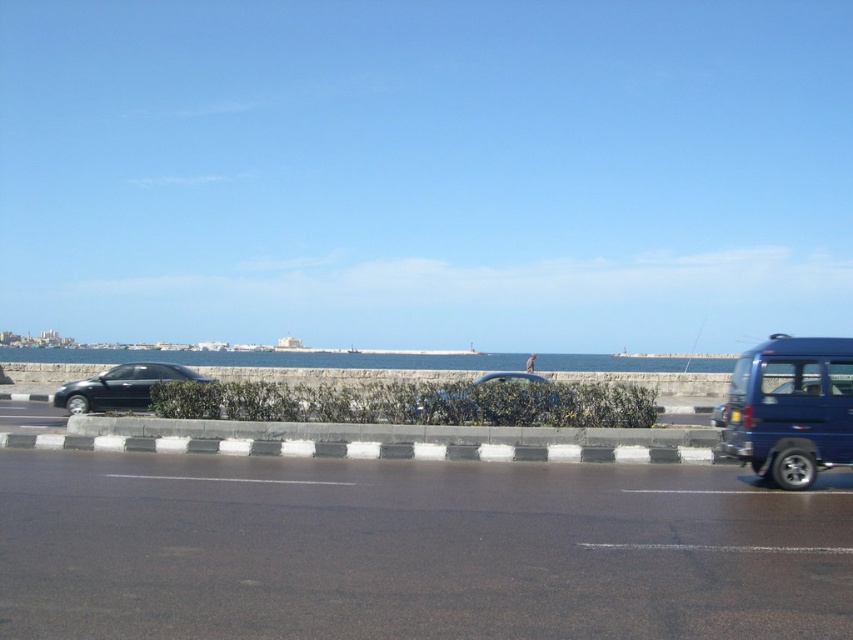
Question: Can you confirm if black asphalt highway at center is positioned above black plastic license plate at right?

Choices:
 (A) yes
 (B) no

Answer: (B)

Question: In this image, where is black asphalt highway at center located relative to blue water at center?

Choices:
 (A) above
 (B) below

Answer: (A)

Question: Is black asphalt highway at center below shiny black sedan at left?

Choices:
 (A) no
 (B) yes

Answer: (B)

Question: Which of the following is the farthest from the observer?

Choices:
 (A) (840, 353)
 (B) (729, 412)

Answer: (B)

Question: Among these objects, which one is farthest from the camera?

Choices:
 (A) black plastic license plate at right
 (B) shiny black sedan at left
 (C) black asphalt highway at center
 (D) blue water at center

Answer: (D)

Question: Among these points, which one is nearest to the camera?

Choices:
 (A) (730, 420)
 (B) (843, 412)
 (C) (164, 362)

Answer: (B)